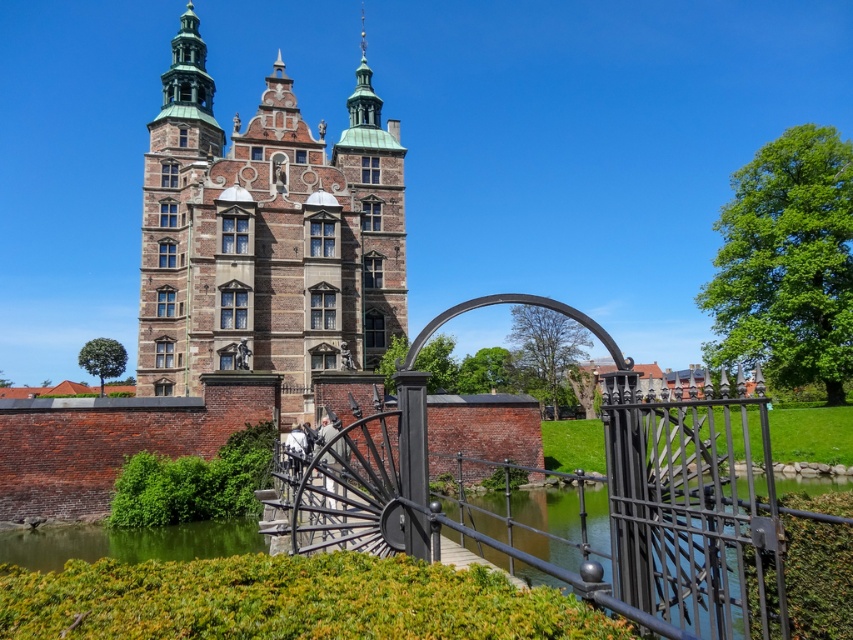
Question: Which object appears closest to the camera in this image?

Choices:
 (A) green water at lower left
 (B) black wrought iron gate at center

Answer: (B)

Question: Which object is positioned closest to the brown brick church at upper left?

Choices:
 (A) black wrought iron gate at center
 (B) green water at lower left

Answer: (A)

Question: Is brown brick church at upper left to the right of green water at lower left from the viewer's perspective?

Choices:
 (A) no
 (B) yes

Answer: (B)

Question: Can you confirm if black wrought iron gate at center is positioned below green water at lower left?

Choices:
 (A) no
 (B) yes

Answer: (A)

Question: Observing the image, what is the correct spatial positioning of brown brick church at upper left in reference to green water at lower left?

Choices:
 (A) above
 (B) below

Answer: (A)

Question: Which of the following is the closest to the observer?

Choices:
 (A) green water at lower left
 (B) black wrought iron gate at center
 (C) brown brick church at upper left

Answer: (B)